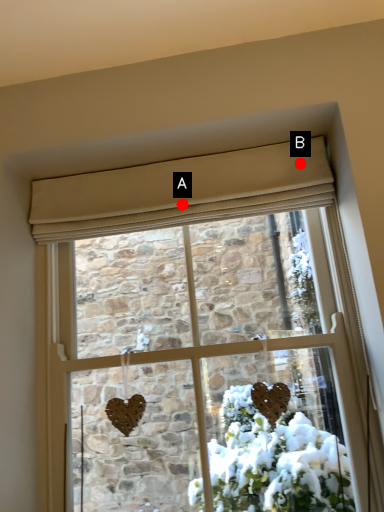
Question: Two points are circled on the image, labeled by A and B beside each circle. Among these points, which one is nearest to the camera?

Choices:
 (A) A is closer
 (B) B is closer

Answer: (B)